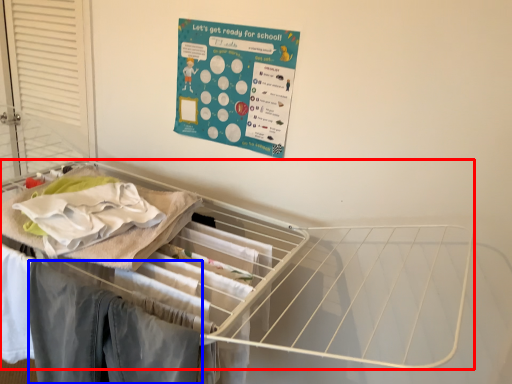
Question: Which object appears closest to the camera in this image, furniture (highlighted by a red box) or clothing (highlighted by a blue box)?

Choices:
 (A) furniture
 (B) clothing

Answer: (A)